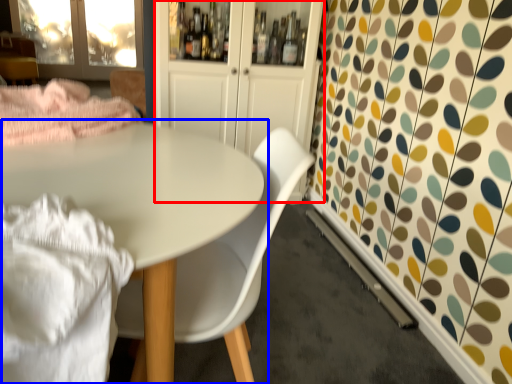
Question: Among these objects, which one is farthest to the camera, dresser (highlighted by a red box) or table (highlighted by a blue box)?

Choices:
 (A) dresser
 (B) table

Answer: (A)